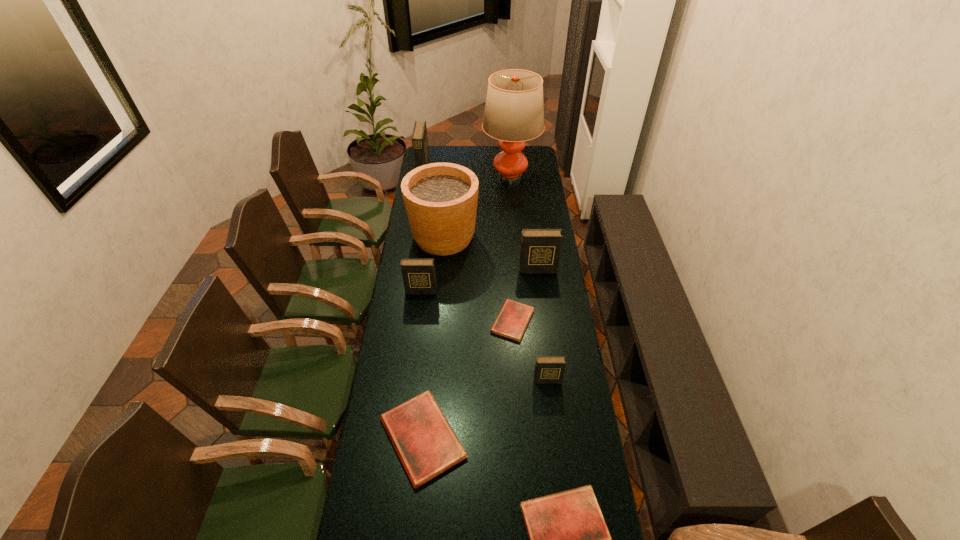
The width and height of the screenshot is (960, 540). Identify the location of blank area in the image that satisfies the following two spatial constraints: 1. on the front cover of the third biggest dark diary; 2. on the right side of the fourth farthest diary. (418, 321).

The height and width of the screenshot is (540, 960). I want to click on free space that satisfies the following two spatial constraints: 1. on the front cover of the farthest dark diary; 2. on the back side of the biggest red diary, so click(x=380, y=438).

Locate an element on the screen. blank area in the image that satisfies the following two spatial constraints: 1. on the front cover of the shortest diary; 2. on the right side of the biggest dark diary is located at coordinates (399, 321).